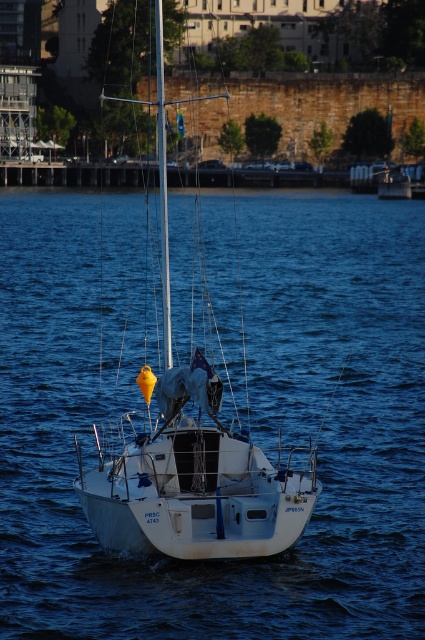
Between point (328, 445) and point (209, 540), which one is positioned in front?

Point (209, 540) is more forward.

Can you confirm if white matte water at center is taller than white matte sailboat at center?

No.

At what (x,y) coordinates should I click in order to perform the action: click on white matte water at center. Please return your answer as a coordinate pair (x, y). Image resolution: width=425 pixels, height=640 pixels. Looking at the image, I should click on (249, 406).